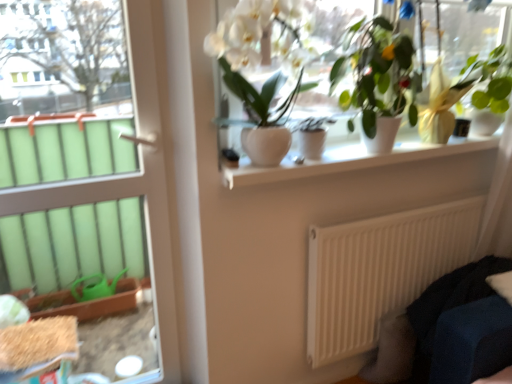
Question: From a real-world perspective, is green matte plant at upper center, arranged as the 2th houseplant when viewed from the right, below dark blue fabric couch at lower right?

Choices:
 (A) yes
 (B) no

Answer: (B)

Question: From the image's perspective, is green matte plant at upper center, arranged as the 2th houseplant when viewed from the right, located beneath dark blue fabric couch at lower right?

Choices:
 (A) yes
 (B) no

Answer: (B)

Question: Can you confirm if green matte plant at upper center, arranged as the 2th houseplant when viewed from the right, is positioned to the right of dark blue fabric couch at lower right?

Choices:
 (A) yes
 (B) no

Answer: (B)

Question: From a real-world perspective, is green matte plant at upper center, arranged as the 2th houseplant when viewed from the right, physically above dark blue fabric couch at lower right?

Choices:
 (A) yes
 (B) no

Answer: (A)

Question: Is green matte plant at upper center, arranged as the 2th houseplant when viewed from the right, at the left side of dark blue fabric couch at lower right?

Choices:
 (A) no
 (B) yes

Answer: (B)

Question: From the image's perspective, is green matte plant at upper center, arranged as the 2th houseplant when viewed from the right, on dark blue fabric couch at lower right?

Choices:
 (A) yes
 (B) no

Answer: (A)

Question: From a real-world perspective, is green matte plant at upper center, placed as the third houseplant when sorted from left to right, physically above green glossy plant at upper right, arranged as the first houseplant when viewed from the right?

Choices:
 (A) yes
 (B) no

Answer: (A)

Question: Is green matte plant at upper center, arranged as the 2th houseplant when viewed from the right, at the left side of green glossy plant at upper right, arranged as the first houseplant when viewed from the right?

Choices:
 (A) yes
 (B) no

Answer: (A)

Question: Does green matte plant at upper center, placed as the third houseplant when sorted from left to right, have a larger size compared to green glossy plant at upper right, arranged as the first houseplant when viewed from the right?

Choices:
 (A) yes
 (B) no

Answer: (A)

Question: Is green matte plant at upper center, arranged as the 2th houseplant when viewed from the right, positioned before green glossy plant at upper right, arranged as the first houseplant when viewed from the right?

Choices:
 (A) yes
 (B) no

Answer: (A)

Question: Is green matte plant at upper center, arranged as the 2th houseplant when viewed from the right, in contact with green glossy plant at upper right, arranged as the first houseplant when viewed from the right?

Choices:
 (A) yes
 (B) no

Answer: (B)

Question: From a real-world perspective, is green matte plant at upper center, arranged as the 2th houseplant when viewed from the right, below green glossy plant at upper right, marked as the fourth houseplant in a left-to-right arrangement?

Choices:
 (A) no
 (B) yes

Answer: (A)

Question: Is white glossy window sill at upper center thinner than matte white pot at center, acting as the 3th houseplant starting from the right?

Choices:
 (A) yes
 (B) no

Answer: (B)